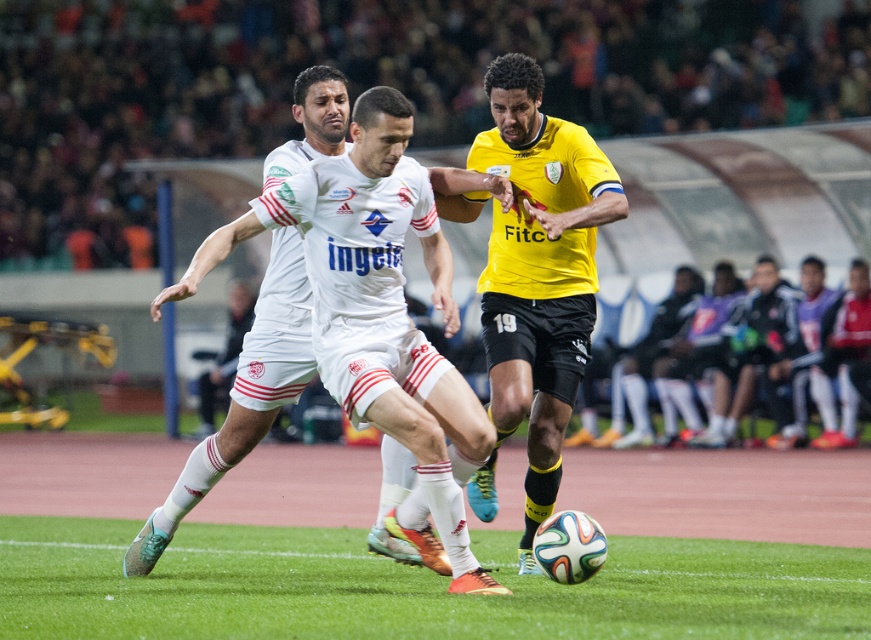
Question: Which object is closer to the camera taking this photo?

Choices:
 (A) yellow matte jersey at center
 (B) white matte jersey at center

Answer: (B)

Question: Is white matte jersey at center closer to the viewer compared to yellow matte jersey at center?

Choices:
 (A) yes
 (B) no

Answer: (A)

Question: Does white matte jersey at center lie in front of yellow matte jersey at center?

Choices:
 (A) yes
 (B) no

Answer: (A)

Question: Can you confirm if white matte jersey at center is positioned to the right of yellow matte jersey at center?

Choices:
 (A) no
 (B) yes

Answer: (A)

Question: Which point is closer to the camera?

Choices:
 (A) white matte jersey at center
 (B) yellow matte jersey at center

Answer: (A)